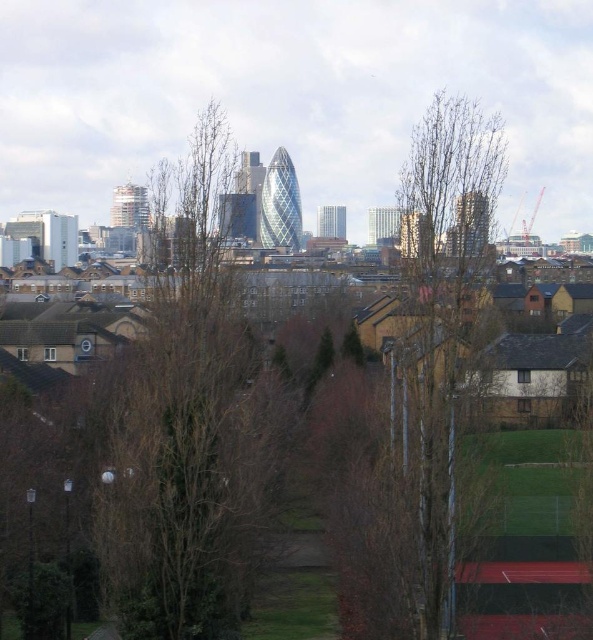
Which is behind, point (142, 365) or point (426, 540)?

The point (142, 365) is behind.

From the picture: Does bare branches at center lie in front of bare wood tree at center?

No, it is not.

What do you see at coordinates (190, 432) in the screenshot? I see `bare branches at center` at bounding box center [190, 432].

Where is `bare branches at center`? Image resolution: width=593 pixels, height=640 pixels. bare branches at center is located at coordinates (190, 432).